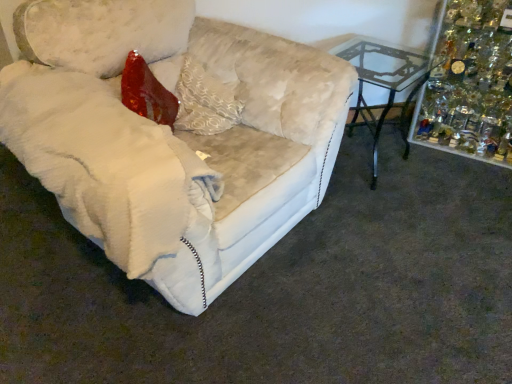
Question: Can you confirm if clear glass table at center right is thinner than white textured pillow at center?

Choices:
 (A) yes
 (B) no

Answer: (B)

Question: Considering the relative sizes of clear glass table at center right and white textured pillow at center in the image provided, is clear glass table at center right bigger than white textured pillow at center?

Choices:
 (A) no
 (B) yes

Answer: (B)

Question: From a real-world perspective, does clear glass table at center right stand above white textured pillow at center?

Choices:
 (A) yes
 (B) no

Answer: (B)

Question: From the image's perspective, is clear glass table at center right located above white textured pillow at center?

Choices:
 (A) yes
 (B) no

Answer: (A)

Question: Can you confirm if clear glass table at center right is positioned to the left of white textured pillow at center?

Choices:
 (A) no
 (B) yes

Answer: (A)

Question: Is clear glass table at center right positioned behind white textured pillow at center?

Choices:
 (A) yes
 (B) no

Answer: (A)

Question: Is the position of shiny glass ornaments at upper right more distant than that of white plush couch at left?

Choices:
 (A) no
 (B) yes

Answer: (B)

Question: From a real-world perspective, is shiny glass ornaments at upper right beneath white plush couch at left?

Choices:
 (A) yes
 (B) no

Answer: (A)

Question: Can you see shiny glass ornaments at upper right touching white plush couch at left?

Choices:
 (A) yes
 (B) no

Answer: (B)

Question: Is shiny glass ornaments at upper right oriented away from white plush couch at left?

Choices:
 (A) yes
 (B) no

Answer: (B)

Question: Considering the relative sizes of shiny glass ornaments at upper right and white plush couch at left in the image provided, is shiny glass ornaments at upper right taller than white plush couch at left?

Choices:
 (A) yes
 (B) no

Answer: (B)

Question: Is shiny glass ornaments at upper right located outside white plush couch at left?

Choices:
 (A) yes
 (B) no

Answer: (A)

Question: Is white plush couch at left wider than white textured pillow at center?

Choices:
 (A) yes
 (B) no

Answer: (A)